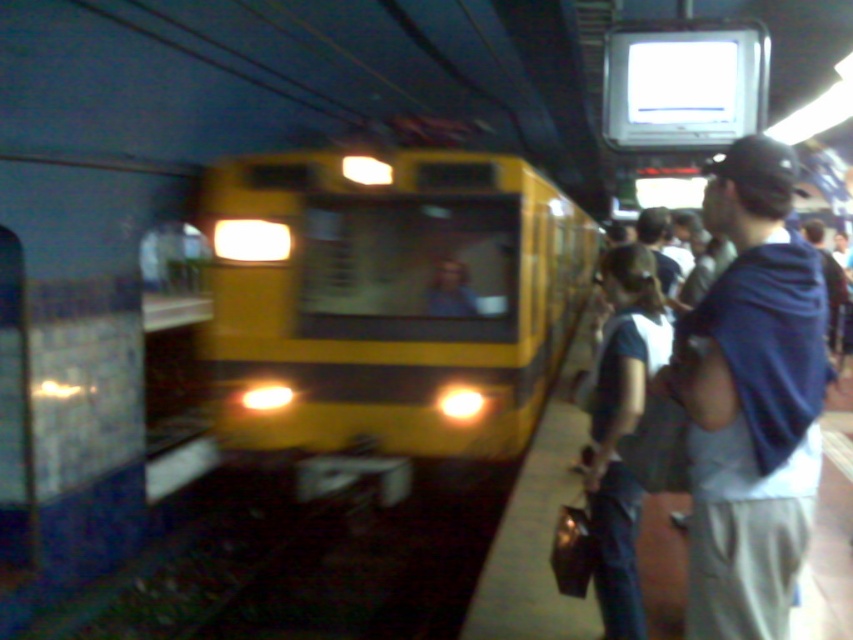
Question: Which point is closer to the camera?

Choices:
 (A) dark blue fabric draped at right
 (B) yellow matte train at center

Answer: (A)

Question: Which of the following is the closest to the observer?

Choices:
 (A) yellow matte train at center
 (B) dark blue fabric draped at right

Answer: (B)

Question: Observing the image, what is the correct spatial positioning of yellow matte train at center in reference to dark blue fabric draped at right?

Choices:
 (A) left
 (B) right

Answer: (A)

Question: Is yellow matte train at center wider than dark blue fabric draped at right?

Choices:
 (A) no
 (B) yes

Answer: (B)

Question: Does yellow matte train at center appear over dark blue fabric draped at right?

Choices:
 (A) yes
 (B) no

Answer: (A)